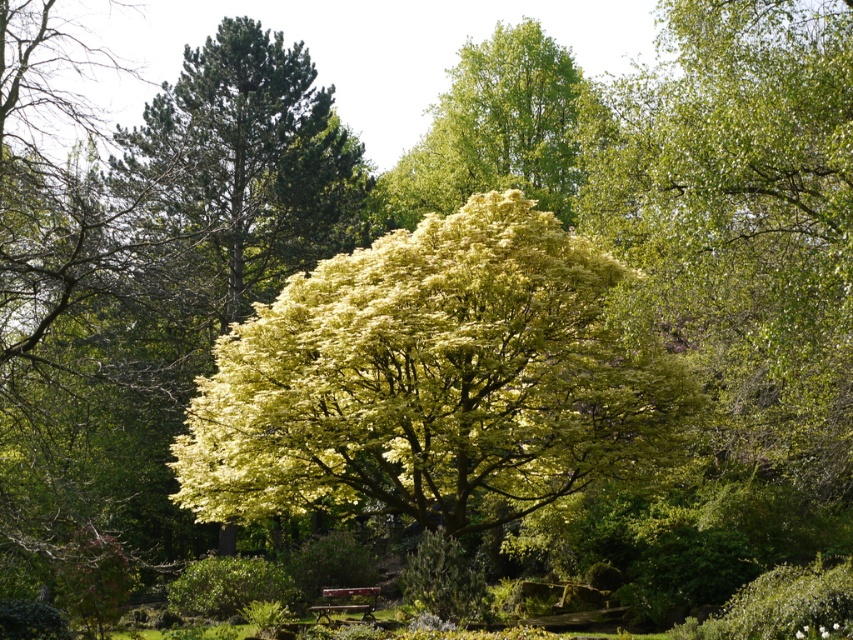
Is green leafy tree at upper center wider than wooden bench at center?

Correct, the width of green leafy tree at upper center exceeds that of wooden bench at center.

This screenshot has width=853, height=640. What are the coordinates of `green leafy tree at upper center` in the screenshot? It's located at (498, 131).

Describe the element at coordinates (498, 131) in the screenshot. The height and width of the screenshot is (640, 853). I see `green leafy tree at upper center` at that location.

You are a GUI agent. You are given a task and a screenshot of the screen. Output one action in this format:
    pyautogui.click(x=<x>, y=<y>)
    Task: Click on the green leafy tree at upper center
    The image size is (853, 640).
    Given the screenshot: What is the action you would take?
    pyautogui.click(x=498, y=131)

Which is in front, point (407, 324) or point (373, 595)?

Point (407, 324) is more forward.

Measure the distance between yellow-green leafy tree at center and camera.

yellow-green leafy tree at center is 16.21 meters away from camera.

Where is `yellow-green leafy tree at center`? The height and width of the screenshot is (640, 853). yellow-green leafy tree at center is located at coordinates (430, 380).

Is point (270, 404) farther from viewer compared to point (430, 193)?

No, it is not.

I want to click on yellow-green leafy tree at center, so (430, 380).